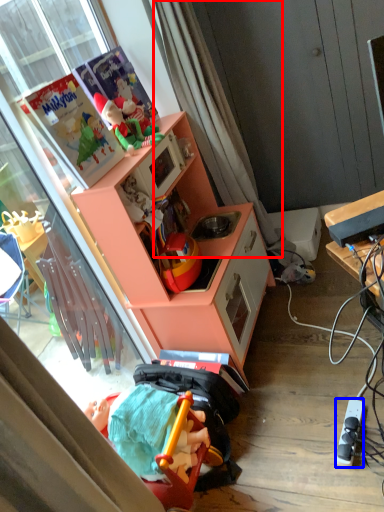
Question: Which of the following is the closest to the observer, curtain (highlighted by a red box) or power outlet (highlighted by a blue box)?

Choices:
 (A) curtain
 (B) power outlet

Answer: (B)